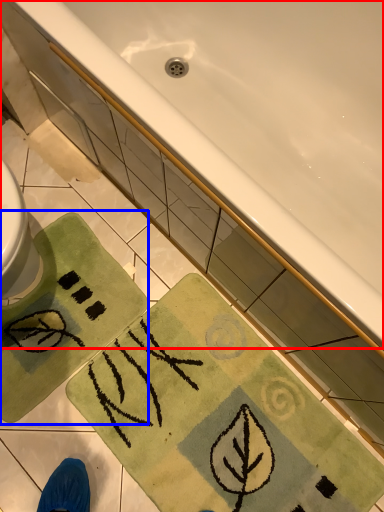
Question: Which object is further to the camera taking this photo, bathtub (highlighted by a red box) or beach towel (highlighted by a blue box)?

Choices:
 (A) bathtub
 (B) beach towel

Answer: (B)